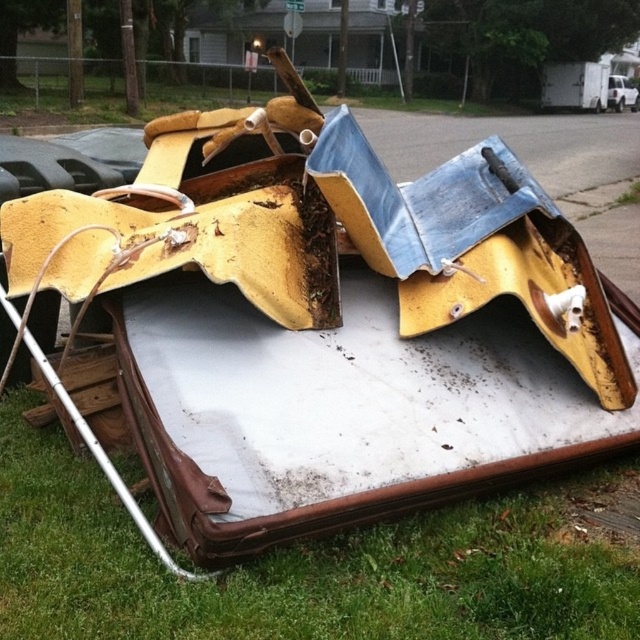
You are standing at the point marked by the coordinates point (301, 564) in the image. According to the scene description, what is the object or surface you are currently standing on?

The point (301, 564) corresponds to green grass at lower left, so you are standing on green grass at lower left.

You are a delivery person who needs to move a large package from the green grass at lower left to the white matte truck at upper right. What is the minimum distance you need to cover to reach the truck from the grass?

The minimum distance you need to cover to reach the white matte truck at upper right from the green grass at lower left is 22.51 meters.

You are standing at the edge of the residential street scene and want to walk to the white matte truck at upper right. Which direction should you head to avoid stepping on the green grass at lower left?

The green grass at lower left is positioned on the left side of the white matte truck at upper right. To avoid stepping on the green grass at lower left, you should head to the right side of the white matte truck at upper right.